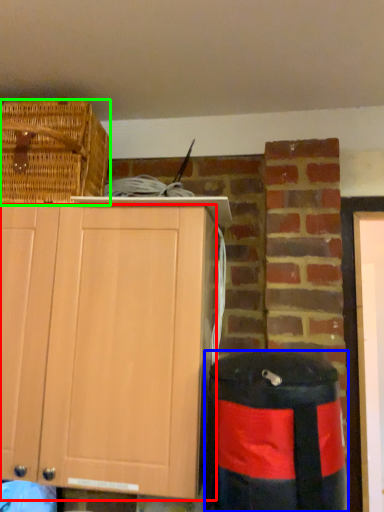
Question: Which is nearer to the cabinetry (highlighted by a red box)? trash bin/can (highlighted by a blue box) or picnic basket (highlighted by a green box).

Choices:
 (A) trash bin/can
 (B) picnic basket

Answer: (A)